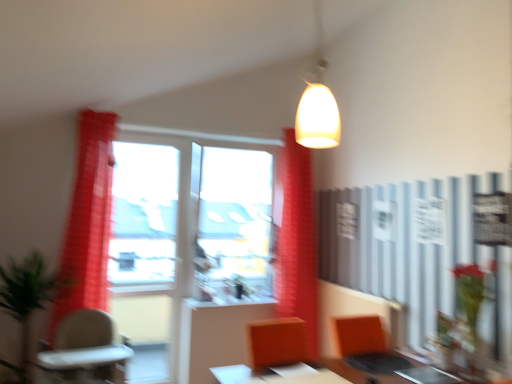
Question: Can you confirm if red sheer curtain at left, the first curtain positioned from the front, is smaller than beige plastic chair at lower left?

Choices:
 (A) no
 (B) yes

Answer: (B)

Question: From a real-world perspective, is red sheer curtain at left, the first curtain positioned from the front, on beige plastic chair at lower left?

Choices:
 (A) no
 (B) yes

Answer: (B)

Question: Would you say red sheer curtain at left, the first curtain positioned from the front, contains beige plastic chair at lower left?

Choices:
 (A) no
 (B) yes

Answer: (A)

Question: Considering the relative sizes of red sheer curtain at left, the first curtain positioned from the front, and beige plastic chair at lower left in the image provided, is red sheer curtain at left, the first curtain positioned from the front, wider than beige plastic chair at lower left?

Choices:
 (A) no
 (B) yes

Answer: (A)

Question: From the image's perspective, is red sheer curtain at left, the 2th curtain positioned from the right, beneath beige plastic chair at lower left?

Choices:
 (A) no
 (B) yes

Answer: (A)

Question: In the image, is white glossy table at center, the 1th table when ordered from left to right, positioned in front of or behind beige plastic chair at lower left?

Choices:
 (A) front
 (B) behind

Answer: (A)

Question: In the image, is white glossy table at center, which is the second table from right to left, on the left side or the right side of beige plastic chair at lower left?

Choices:
 (A) right
 (B) left

Answer: (A)

Question: From a real-world perspective, is white glossy table at center, the 1th table when ordered from left to right, physically located above or below beige plastic chair at lower left?

Choices:
 (A) above
 (B) below

Answer: (A)

Question: Considering the positions of white glossy table at center, which is the second table from right to left, and beige plastic chair at lower left in the image, is white glossy table at center, which is the second table from right to left, bigger or smaller than beige plastic chair at lower left?

Choices:
 (A) small
 (B) big

Answer: (A)

Question: From their relative heights in the image, would you say green matte plant at center, marked as the 2th plant in a front-to-back arrangement, is taller or shorter than transparent glass window at center, which is the second window screen from left to right?

Choices:
 (A) short
 (B) tall

Answer: (A)

Question: From the image's perspective, is green matte plant at center, which is the 2th plant in left-to-right order, positioned above or below transparent glass window at center, which is the second window screen from left to right?

Choices:
 (A) below
 (B) above

Answer: (A)

Question: In terms of width, does green matte plant at center, which is the 1th plant from right to left, look wider or thinner when compared to transparent glass window at center, which ranks as the first window screen in right-to-left order?

Choices:
 (A) thin
 (B) wide

Answer: (A)

Question: From a real-world perspective, is green matte plant at center, which is the 2th plant in left-to-right order, positioned above or below transparent glass window at center, which is the second window screen from left to right?

Choices:
 (A) above
 (B) below

Answer: (B)

Question: Considering the positions of metallic silver table at center, which is counted as the second table, starting from the left, and matte white pendant light at upper center in the image, is metallic silver table at center, which is counted as the second table, starting from the left, taller or shorter than matte white pendant light at upper center?

Choices:
 (A) short
 (B) tall

Answer: (A)

Question: Considering the positions of metallic silver table at center, acting as the first table starting from the right, and matte white pendant light at upper center in the image, is metallic silver table at center, acting as the first table starting from the right, bigger or smaller than matte white pendant light at upper center?

Choices:
 (A) big
 (B) small

Answer: (B)